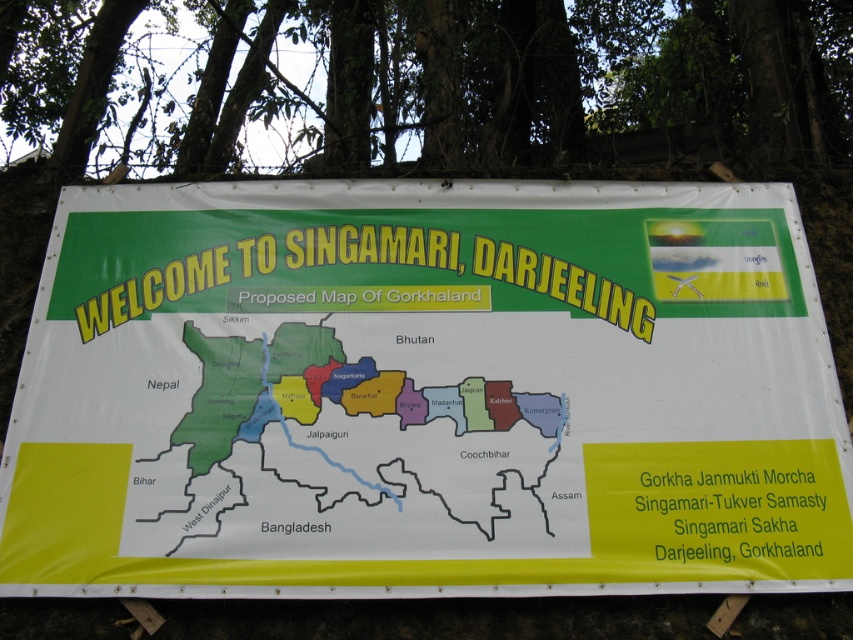
You are a tourist standing in front of the banner and notice both the green leafy tree at upper center and the yellow paper map at center. Which object appears bigger in the image?

The green leafy tree at upper center is larger in size than the yellow paper map at center, so it appears bigger in the image.

In the scene shown: You are a hiker who just arrived at Singamari and wants to check the map to plan your route. However, you notice that the green leafy tree at upper center and the yellow paper map at center are positioned in a way that might block your view. Which object is taller and could potentially block your view of the map?

The green leafy tree at upper center is much taller than the yellow paper map at center, so it could potentially block your view of the map.

You are standing at the camera position looking at the banner. There is a point marked at coordinates [241,256] on the banner. If you want to touch that exact point on the banner with a stick that is 10 feet long, will the stick be long enough?

The point at [241,256] is 9.67 feet away from the camera. Since the stick is 10 feet long, it will be long enough to reach the point.